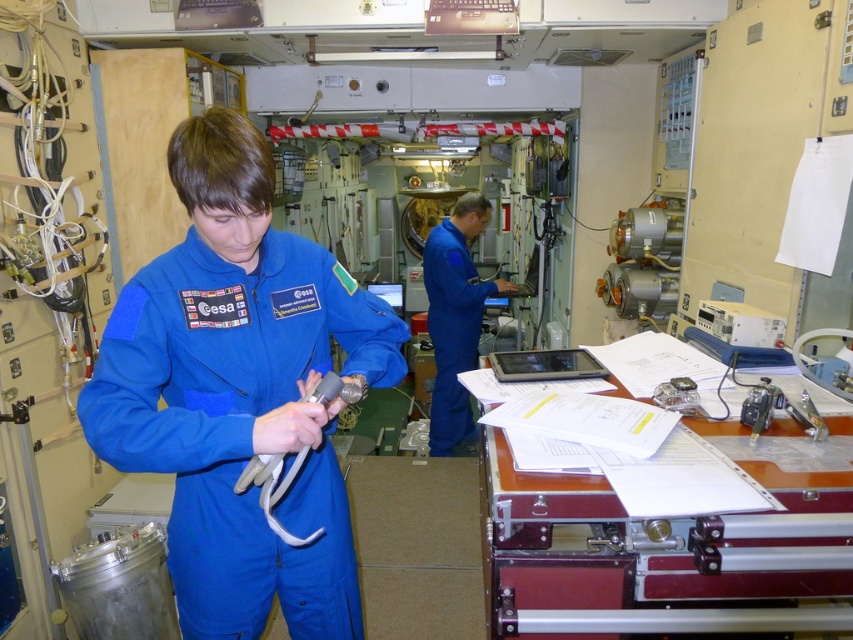
You are an astronaut inside the spacecraft and need to access the white rubber tube at center. Is the blue fabric astronaut suit at center blocking your access to it?

The blue fabric astronaut suit at center is positioned over the white rubber tube at center, so it is blocking access to the tube.

You are an astronaut in the spacecraft and need to hand a tool to the person at point (287, 372). Can you reach them without moving from your current position?

The distance between you and the person at point (287, 372) is 4.44 feet. Since the average human arm length is about 2.5 feet, you cannot reach them without moving closer.

You are an astronaut on a space mission and need to reach a control panel located at point (218, 572) and another panel at point (444, 298). Which control panel will you reach first if you move straight ahead?

You will reach the control panel at point (218, 572) first because it is closer to you than the control panel at point (444, 298).